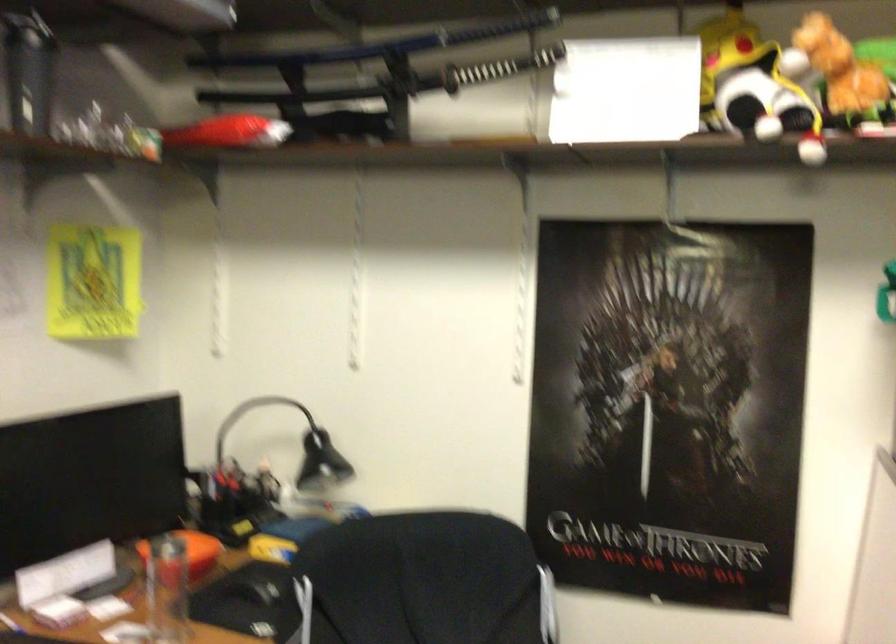
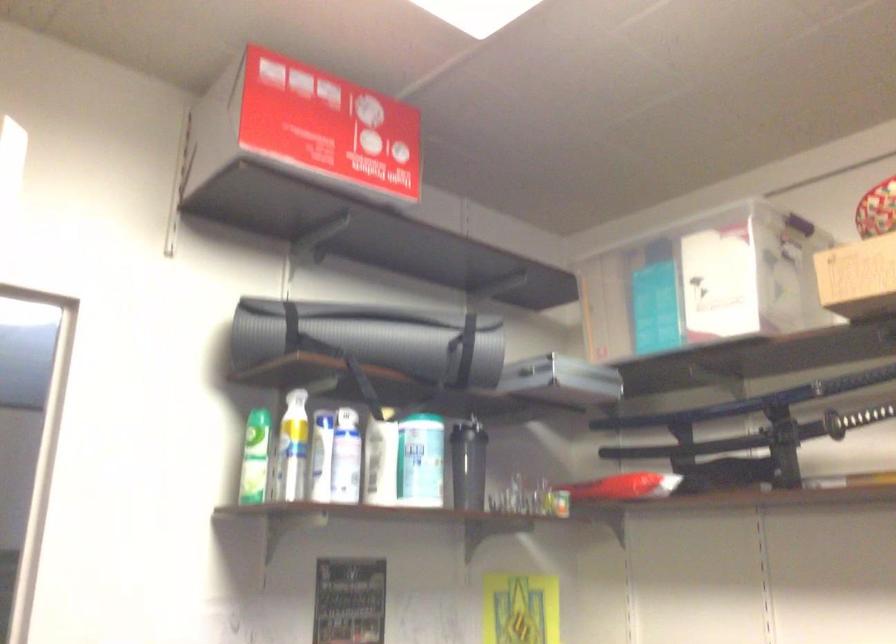
Consider the image. The first image is from the beginning of the video and the second image is from the end. How did the camera likely rotate when shooting the video?

The rotation direction of the camera is left-up.